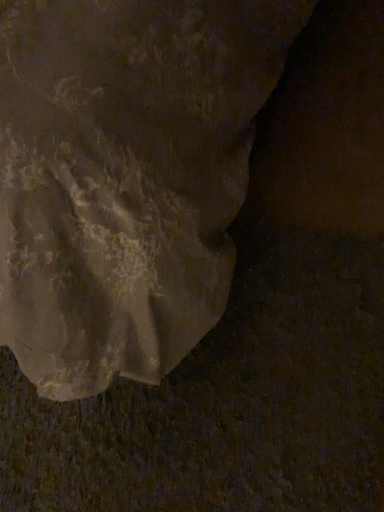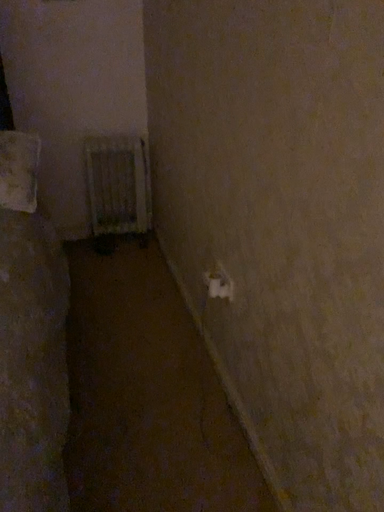
Question: Which way did the camera rotate in the video?

Choices:
 (A) rotated left
 (B) rotated right

Answer: (B)